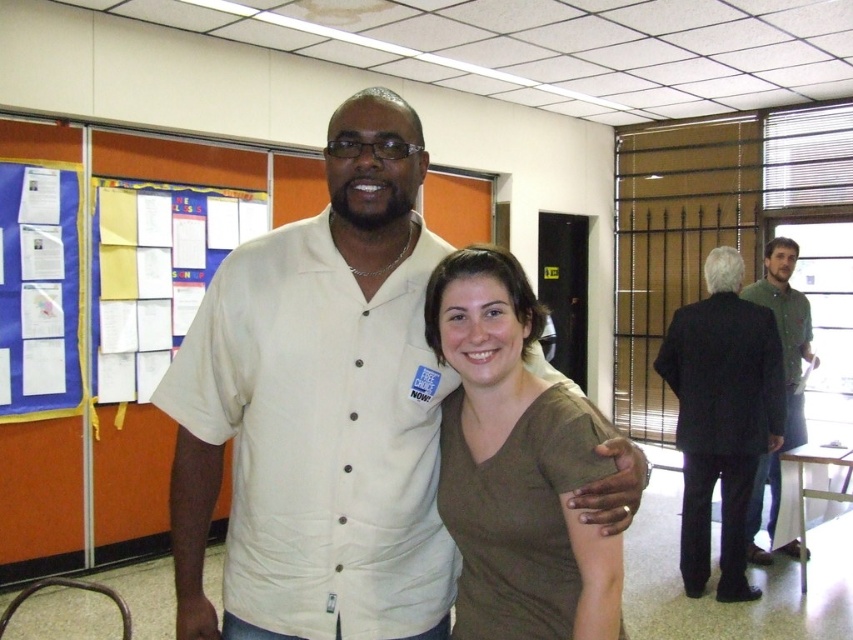
You are a photographer setting up for an event. You need to position two subjects so they can be in the same frame without overlapping. The subjects are the brown matte shirt at center and the black suit at right. Given their current distance apart, can you fit them both in a standard camera frame without moving them?

The brown matte shirt at center and the black suit at right are 8.18 feet apart. A standard camera frame can easily accommodate this distance, so yes, they can both be captured without overlapping by adjusting the zoom or camera angle appropriately.

What is located at the coordinates point (514, 465)?

The coordinates point (514, 465) indicate the location of the brown matte shirt at center.

You are standing in the community center and want to move from the point closer to you to the point further away. Which path would you take between the two points, point (444, 292) and point (683, 552)?

The path from point (444, 292) to point (683, 552) would involve moving away from the viewer since point (444, 292) is closer to you than point (683, 552).